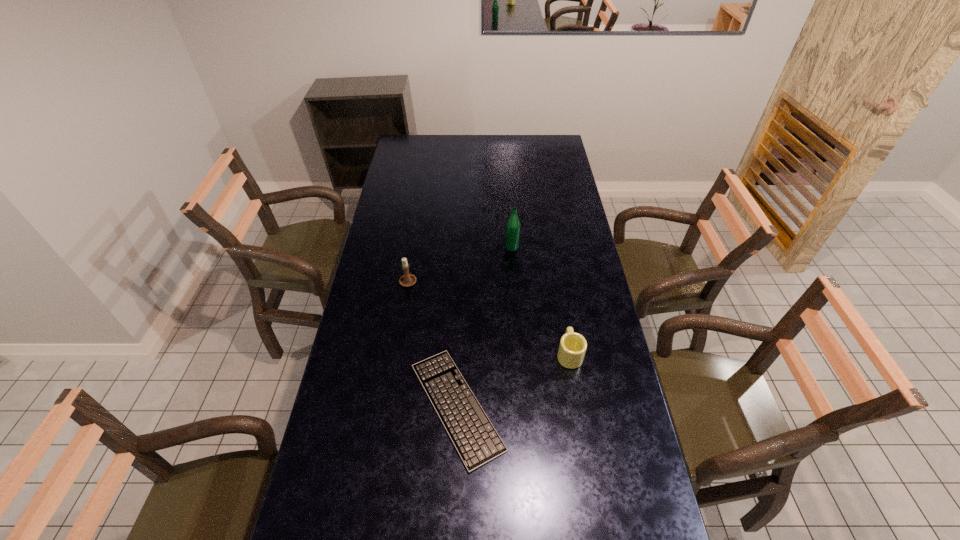
At what (x,y) coordinates should I click in order to perform the action: click on free space at the right edge of the desktop. Please return your answer as a coordinate pair (x, y). Looking at the image, I should click on (583, 364).

Locate an element on the screen. vacant area at the far left corner is located at coordinates (399, 146).

You are a GUI agent. You are given a task and a screenshot of the screen. Output one action in this format:
    pyautogui.click(x=<x>, y=<y>)
    Task: Click on the free space between the second shortest object and the farthest object
    
    Given the screenshot: What is the action you would take?
    click(x=540, y=300)

This screenshot has height=540, width=960. In order to click on unoccupied position between the second object from left to right and the rightmost object in this screenshot , I will do `click(513, 380)`.

What are the coordinates of `empty space between the third shortest object and the shortest object` in the screenshot? It's located at (432, 343).

Find the location of a particular element. The height and width of the screenshot is (540, 960). vacant space that is in between the second farthest object and the mug is located at coordinates (489, 317).

Identify which object is located as the second nearest to the farthest object. Please provide its 2D coordinates. Your answer should be formatted as a tuple, i.e. [(x, y)], where the tuple contains the x and y coordinates of a point satisfying the conditions above.

[(572, 348)]

Locate which object ranks in proximity to the third nearest object. Please provide its 2D coordinates. Your answer should be formatted as a tuple, i.e. [(x, y)], where the tuple contains the x and y coordinates of a point satisfying the conditions above.

[(473, 435)]